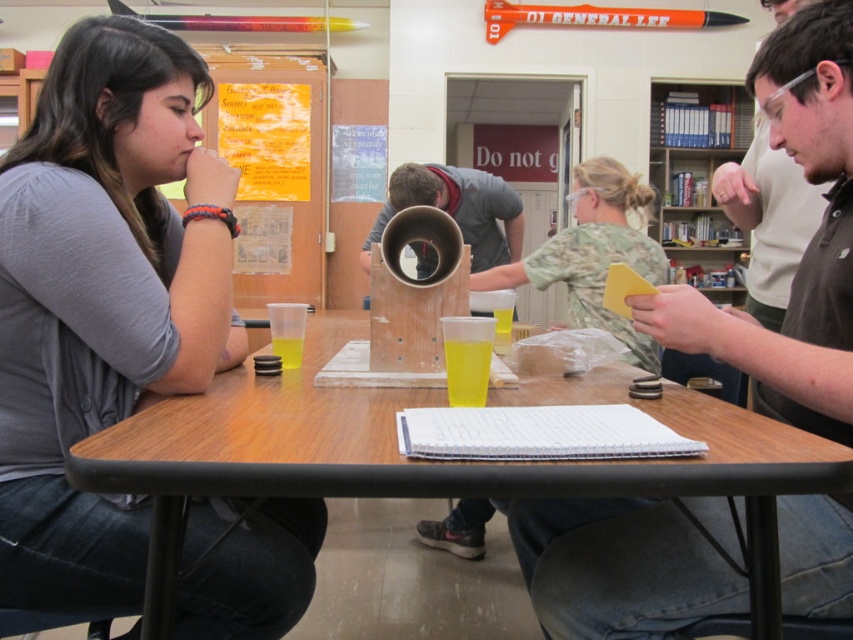
You are a student in the classroom and need to hand in an assignment to the teacher standing at the front. The teacher is looking at the matte gray shirt at left and the matte brown shirt at center. Which student should you approach first based on their position?

The matte gray shirt at left is located above matte brown shirt at center, so you should approach the matte gray shirt at left first as it is closer to the front of the classroom.

You are a student in the classroom and want to reach the wooden pipe at center without moving the matte gray shirt at left. Is this possible?

The matte gray shirt at left is taller than the wooden pipe at center, so it might block your view or access to the wooden pipe at center. You may need to move the matte gray shirt at left to reach the wooden pipe at center.